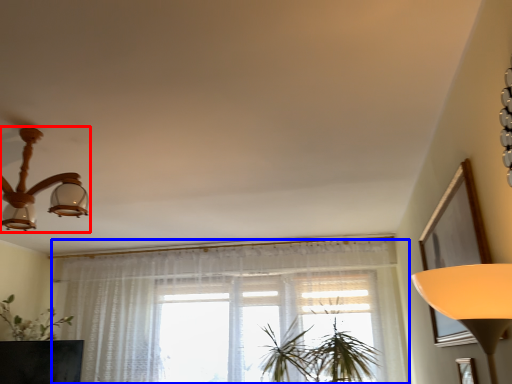
Question: Which of the following is the farthest to the observer, lamp (highlighted by a red box) or curtain (highlighted by a blue box)?

Choices:
 (A) lamp
 (B) curtain

Answer: (B)